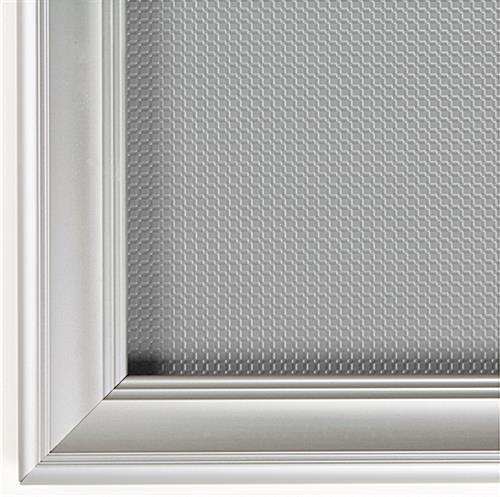
Point to all occurrences of where a  picture would go in frame in the image. Your answer should be formatted as a list of tuples, i.e. [(x1, y1), (x2, y2), ...], where each tuple contains the x and y coordinates of a point satisfying the conditions above.

[(210, 38), (440, 94), (449, 263), (217, 261)]